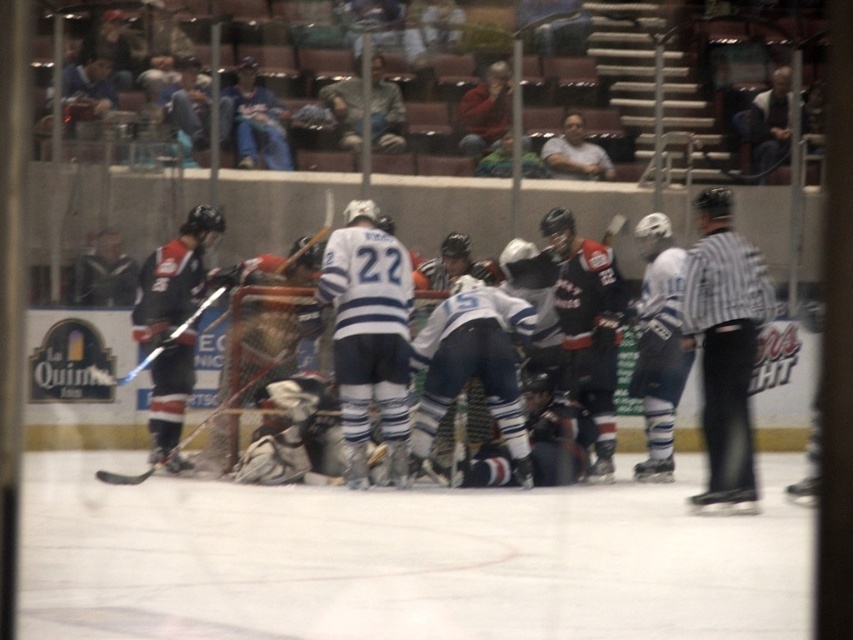
Question: Can you confirm if white jersey at center is positioned below shiny blue hockey stick at left?

Choices:
 (A) no
 (B) yes

Answer: (B)

Question: Which point is farther to the camera?

Choices:
 (A) matte black jersey at left
 (B) white jersey at center
 (C) black glossy hockey stick at lower center
 (D) black striped shirt at right

Answer: (B)

Question: Based on their relative distances, which object is farther from the black glossy hockey stick at lower center?

Choices:
 (A) matte black jersey at left
 (B) white jersey at center

Answer: (A)

Question: Estimate the real-world distances between objects in this image. Which object is closer to the black striped shirt at right?

Choices:
 (A) shiny blue hockey stick at left
 (B) matte black jersey at left
 (C) black glossy hockey stick at lower center
 (D) white jersey at center

Answer: (D)

Question: Is matte black jersey at left above white jersey at center?

Choices:
 (A) no
 (B) yes

Answer: (B)

Question: Is white jersey at center to the right of black glossy hockey stick at lower center from the viewer's perspective?

Choices:
 (A) no
 (B) yes

Answer: (B)